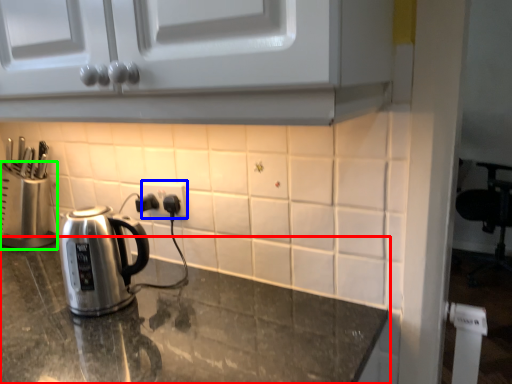
Question: Considering the real-world distances, which object is farthest from countertop (highlighted by a red box)? electric outlet (highlighted by a blue box) or appliance (highlighted by a green box)?

Choices:
 (A) electric outlet
 (B) appliance

Answer: (B)